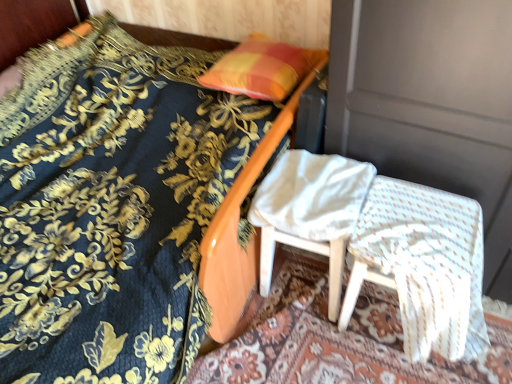
Question: From the image's perspective, does orange/yellow fabric pillow at upper center appear lower than white wood chair at center, which is counted as the first chair, starting from the left?

Choices:
 (A) yes
 (B) no

Answer: (B)

Question: Is orange/yellow fabric pillow at upper center in front of white wood chair at center, which is counted as the first chair, starting from the left?

Choices:
 (A) yes
 (B) no

Answer: (B)

Question: Is orange/yellow fabric pillow at upper center shorter than white wood chair at center, the second chair from the right?

Choices:
 (A) yes
 (B) no

Answer: (A)

Question: Is orange/yellow fabric pillow at upper center wider than white wood chair at center, which is counted as the first chair, starting from the left?

Choices:
 (A) no
 (B) yes

Answer: (B)

Question: Is orange/yellow fabric pillow at upper center next to white wood chair at center, which is counted as the first chair, starting from the left, and touching it?

Choices:
 (A) yes
 (B) no

Answer: (B)

Question: Considering the relative sizes of orange/yellow fabric pillow at upper center and white wood chair at center, which is counted as the first chair, starting from the left, in the image provided, is orange/yellow fabric pillow at upper center bigger than white wood chair at center, which is counted as the first chair, starting from the left,?

Choices:
 (A) no
 (B) yes

Answer: (A)

Question: Does white woven fabric chair at lower right, the 1th chair from the right, have a smaller size compared to velvet blue bedspread at upper left?

Choices:
 (A) no
 (B) yes

Answer: (B)

Question: From a real-world perspective, is white woven fabric chair at lower right, which is the second chair from left to right, positioned under velvet blue bedspread at upper left based on gravity?

Choices:
 (A) yes
 (B) no

Answer: (A)

Question: Is white woven fabric chair at lower right, the 1th chair from the right, closer to camera compared to velvet blue bedspread at upper left?

Choices:
 (A) no
 (B) yes

Answer: (A)

Question: From a real-world perspective, is white woven fabric chair at lower right, which is the second chair from left to right, on velvet blue bedspread at upper left?

Choices:
 (A) yes
 (B) no

Answer: (B)

Question: From the image's perspective, is white woven fabric chair at lower right, the 1th chair from the right, beneath velvet blue bedspread at upper left?

Choices:
 (A) no
 (B) yes

Answer: (B)

Question: From the image's perspective, is white woven fabric chair at lower right, which is the second chair from left to right, over velvet blue bedspread at upper left?

Choices:
 (A) yes
 (B) no

Answer: (B)

Question: Can you confirm if orange/yellow fabric pillow at upper center is bigger than white woven fabric chair at lower right, the 1th chair from the right?

Choices:
 (A) no
 (B) yes

Answer: (A)